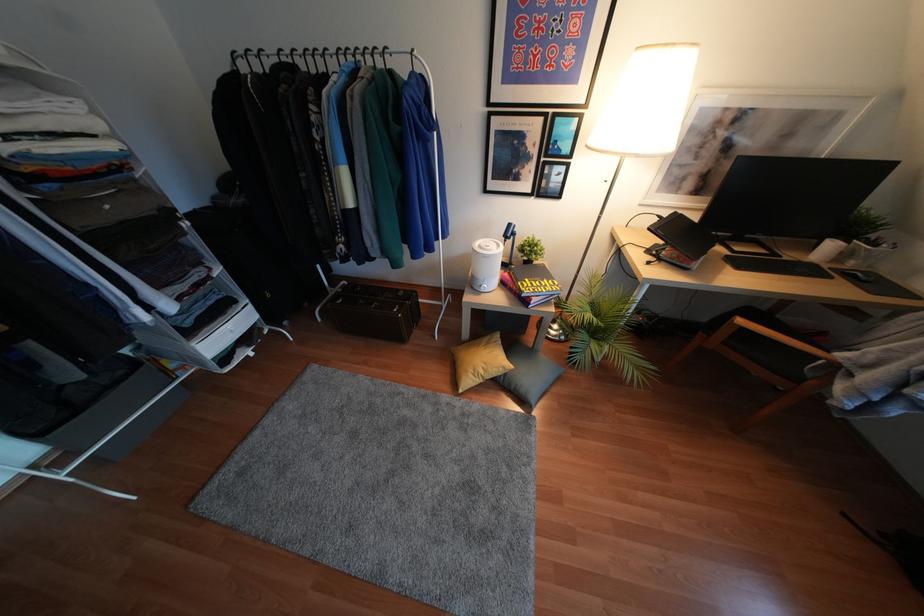
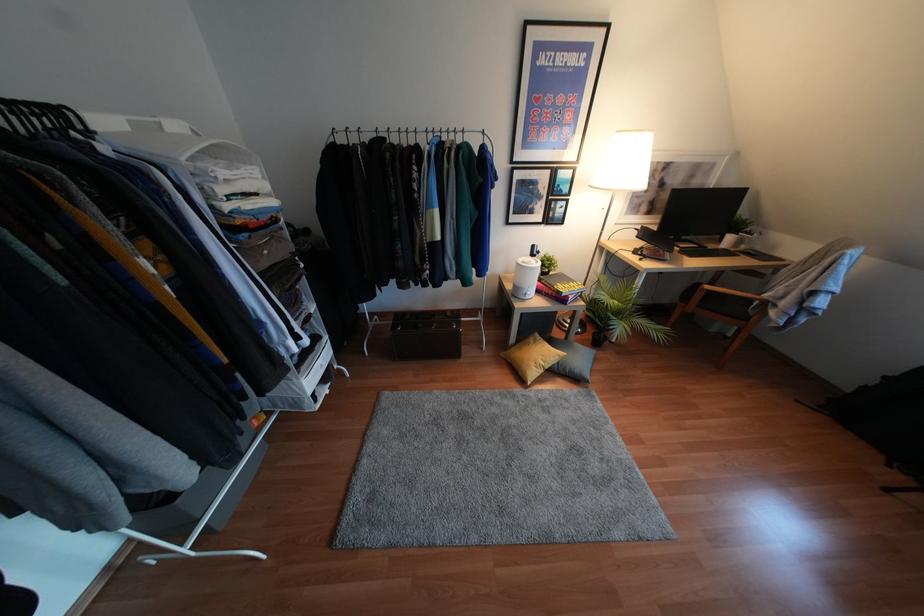
The point at (480,371) is marked in the first image. Where is the corresponding point in the second image?

(541, 363)